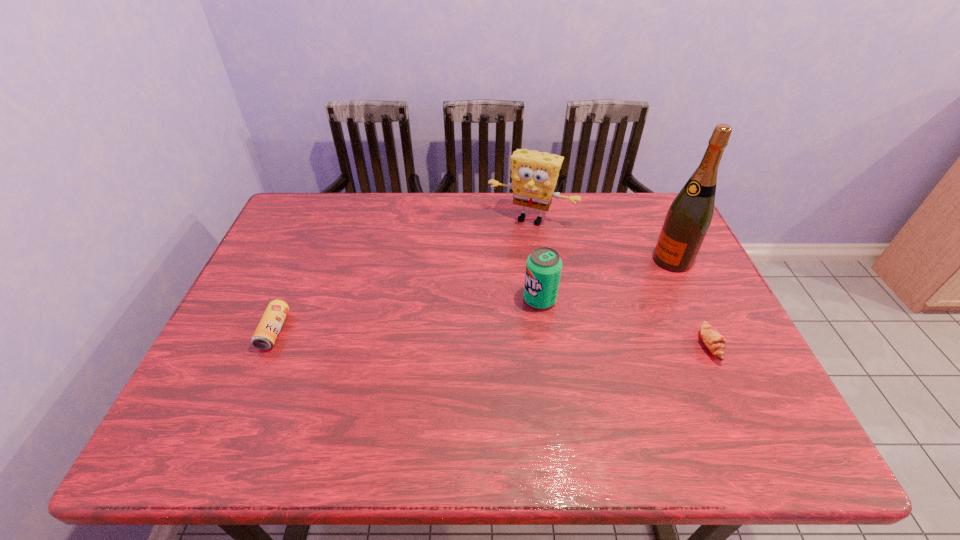
The width and height of the screenshot is (960, 540). I want to click on the leftmost object, so click(265, 335).

This screenshot has height=540, width=960. In order to click on pastry in this screenshot , I will do `click(713, 340)`.

You are a GUI agent. You are given a task and a screenshot of the screen. Output one action in this format:
    pyautogui.click(x=<x>, y=<y>)
    Task: Click on the pop soda
    
    Given the screenshot: What is the action you would take?
    pyautogui.click(x=543, y=267)

Find the location of a particular element. The width and height of the screenshot is (960, 540). sponge is located at coordinates (534, 175).

Find the location of a particular element. This screenshot has width=960, height=540. the second tallest object is located at coordinates (534, 175).

This screenshot has width=960, height=540. Find the location of `the fourth nearest object`. the fourth nearest object is located at coordinates (688, 219).

Find the location of a particular element. the tallest object is located at coordinates (688, 219).

This screenshot has height=540, width=960. What are the coordinates of `vacant area situated 0.130m on the front of the leftmost object` in the screenshot? It's located at (245, 401).

Where is `vacant area located 0.050m on the front-facing side of the pastry`? vacant area located 0.050m on the front-facing side of the pastry is located at coordinates (743, 345).

What are the coordinates of `free region located 0.260m on the front-facing side of the third tallest object` in the screenshot? It's located at (437, 346).